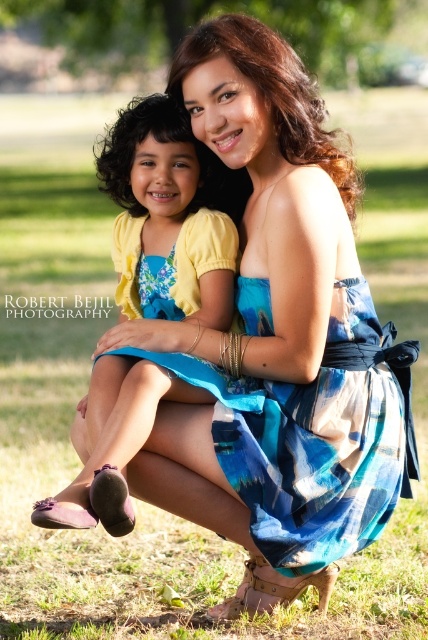
Question: Based on their relative distances, which object is farther from the matte yellow dress at center?

Choices:
 (A) blue plaid dress at center
 (B) green leafy tree at upper center

Answer: (B)

Question: Does blue plaid dress at center come behind green leafy tree at upper center?

Choices:
 (A) yes
 (B) no

Answer: (B)

Question: Which point appears farthest from the camera in this image?

Choices:
 (A) (401, 445)
 (B) (202, 189)

Answer: (B)

Question: Is matte yellow dress at center below green leafy tree at upper center?

Choices:
 (A) yes
 (B) no

Answer: (A)

Question: Is blue plaid dress at center thinner than matte yellow dress at center?

Choices:
 (A) no
 (B) yes

Answer: (A)

Question: Among these objects, which one is nearest to the camera?

Choices:
 (A) green leafy tree at upper center
 (B) blue plaid dress at center
 (C) matte yellow dress at center

Answer: (B)